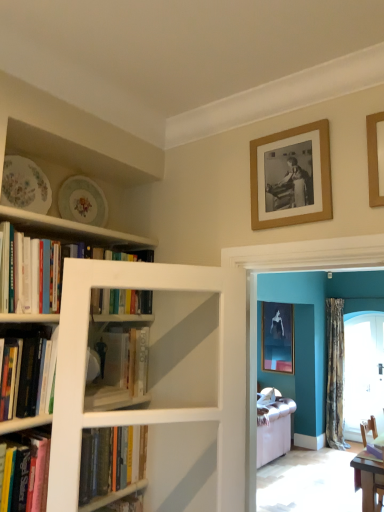
This screenshot has height=512, width=384. Identify the location of hardcover book at center, marked as the fifth book in a top-to-bottom arrangement. (117, 478).

Measure the distance between hardcover books at left, which is the 5th book from bottom to top, and camera.

They are 4.46 feet apart.

The height and width of the screenshot is (512, 384). Describe the element at coordinates (277, 337) in the screenshot. I see `matte black picture frame at upper center, the third picture frame positioned from the front` at that location.

This screenshot has width=384, height=512. What do you see at coordinates (36, 467) in the screenshot?
I see `hardcover book at left, the 2th book when ordered from bottom to top` at bounding box center [36, 467].

Image resolution: width=384 pixels, height=512 pixels. I want to click on clear glass door at right, so 363,371.

Is camouflage fabric curtain at right taller or shorter than matte black picture frame at upper center, positioned as the 3th picture frame in left-to-right order?

In the image, camouflage fabric curtain at right appears to be taller than matte black picture frame at upper center, positioned as the 3th picture frame in left-to-right order.

From the image's perspective, which object appears higher, camouflage fabric curtain at right or matte black picture frame at upper center, which is counted as the 1th picture frame, starting from the right?

matte black picture frame at upper center, which is counted as the 1th picture frame, starting from the right, appears higher in the image.

Is matte black picture frame at upper center, positioned as the third picture frame in top-to-bottom order, at the back of camouflage fabric curtain at right?

camouflage fabric curtain at right is not turned away from matte black picture frame at upper center, positioned as the third picture frame in top-to-bottom order.

Are camouflage fabric curtain at right and matte black picture frame at upper center, which appears as the first picture frame when ordered from the bottom, making contact?

camouflage fabric curtain at right and matte black picture frame at upper center, which appears as the first picture frame when ordered from the bottom, are not in contact.

Considering the positions of points (340, 318) and (47, 365), is point (340, 318) closer to camera compared to point (47, 365)?

No, it is not.

Is hardcover book at left, which is the second book from top to bottom, a part of camouflage fabric curtain at right?

That's incorrect, hardcover book at left, which is the second book from top to bottom, is not inside camouflage fabric curtain at right.

Which of these two, camouflage fabric curtain at right or hardcover book at left, which is the second book from top to bottom, is wider?

With larger width is camouflage fabric curtain at right.

Is camouflage fabric curtain at right positioned before hardcover book at left, which is the second book from top to bottom?

That is False.

How many degrees apart are the facing directions of wooden picture frame at upper right, the second picture frame viewed from the right, and wooden chair at lower right?

The angular difference between wooden picture frame at upper right, the second picture frame viewed from the right, and wooden chair at lower right is 91.3 degrees.

Is wooden picture frame at upper right, arranged as the 1th picture frame when viewed from the front, positioned behind wooden chair at lower right?

That is False.

Between wooden picture frame at upper right, the 1th picture frame viewed from the top, and wooden chair at lower right, which one has more height?

Standing taller between the two is wooden chair at lower right.

Is wooden chair at lower right surrounded by wooden picture frame at upper right, the 3th picture frame when ordered from back to front?

No, wooden picture frame at upper right, the 3th picture frame when ordered from back to front, does not contain wooden chair at lower right.

Can we say porcelain floral plate at upper left, which appears as the first plate when viewed from the right, lies outside hardcover book at left, which is the second book from top to bottom?

Yes, porcelain floral plate at upper left, which appears as the first plate when viewed from the right, is located beyond the bounds of hardcover book at left, which is the second book from top to bottom.

Is porcelain floral plate at upper left, which is the first plate in back-to-front order, positioned far away from hardcover book at left, which appears as the fourth book when ordered from the bottom?

They are positioned close to each other.

How different are the orientations of porcelain floral plate at upper left, which appears as the first plate when viewed from the right, and hardcover book at left, which is the second book from top to bottom, in degrees?

The angle between the facing direction of porcelain floral plate at upper left, which appears as the first plate when viewed from the right, and the facing direction of hardcover book at left, which is the second book from top to bottom, is 0.603 degrees.

Find the location of a particular element. the 2nd book positioned below the porcelain floral plate at upper left, which is the first plate in back-to-front order (from the image's perspective) is located at coordinates (33, 374).

Is wooden framed photo at upper right, which is the 1th picture frame in left-to-right order, beside hardcover book at left, which is the 4th book from top to bottom?

No, wooden framed photo at upper right, which is the 1th picture frame in left-to-right order, is not with hardcover book at left, which is the 4th book from top to bottom.

Considering the sizes of objects wooden framed photo at upper right, the second picture frame positioned from the bottom, and hardcover book at left, the 2th book when ordered from bottom to top, in the image provided, who is wider, wooden framed photo at upper right, the second picture frame positioned from the bottom, or hardcover book at left, the 2th book when ordered from bottom to top,?

hardcover book at left, the 2th book when ordered from bottom to top.

Which is behind, point (263, 144) or point (38, 511)?

The point (263, 144) is more distant.

From a real-world perspective, is wooden framed photo at upper right, which ranks as the 2th picture frame in back-to-front order, physically located above or below hardcover book at left, the 2th book when ordered from bottom to top?

Clearly, from a real-world perspective, wooden framed photo at upper right, which ranks as the 2th picture frame in back-to-front order, is above hardcover book at left, the 2th book when ordered from bottom to top.

Which object is more forward, camouflage fabric curtain at right or porcelain floral plate at upper left, acting as the first plate starting from the left?

porcelain floral plate at upper left, acting as the first plate starting from the left, is more forward.

Is camouflage fabric curtain at right taller or shorter than porcelain floral plate at upper left, which is the 2th plate from right to left?

In the image, camouflage fabric curtain at right appears to be taller than porcelain floral plate at upper left, which is the 2th plate from right to left.

Is camouflage fabric curtain at right next to porcelain floral plate at upper left, marked as the first plate in a front-to-back arrangement?

camouflage fabric curtain at right and porcelain floral plate at upper left, marked as the first plate in a front-to-back arrangement, are not in contact.

Between camouflage fabric curtain at right and porcelain floral plate at upper left, acting as the first plate starting from the left, which one has larger width?

With larger width is camouflage fabric curtain at right.

Consider the image. Is porcelain floral plate at upper left, marked as the second plate in a front-to-back arrangement, to the left or to the right of wooden chair at lower right in the image?

porcelain floral plate at upper left, marked as the second plate in a front-to-back arrangement, is to the left of wooden chair at lower right.

Would you consider porcelain floral plate at upper left, which is the first plate in back-to-front order, to be distant from wooden chair at lower right?

Yes.

Between point (96, 184) and point (380, 484), which one is positioned behind?

The point (380, 484) is farther from the camera.

Between porcelain floral plate at upper left, marked as the second plate in a front-to-back arrangement, and wooden chair at lower right, which one has more height?

wooden chair at lower right.

Which picture frame is the 1st one when counting from the left side of the camouflage fabric curtain at right? Please provide its 2D coordinates.

[(277, 337)]

Image resolution: width=384 pixels, height=512 pixels. There is a camouflage fabric curtain at right. In order to click on the 4th book above it (from the image's perspective) in this screenshot , I will do `click(33, 374)`.

When comparing their distances from wooden picture frame at upper right, the 3th picture frame when ordered from back to front, does hardcover book at left, which is the second book from top to bottom, or porcelain floral plate at upper left, which appears as the first plate when viewed from the right, seem further?

Among the two, hardcover book at left, which is the second book from top to bottom, is located further to wooden picture frame at upper right, the 3th picture frame when ordered from back to front.

Which object lies further to the anchor point wooden framed photo at upper right, which ranks as the 2th picture frame in back-to-front order, porcelain floral plate at upper left, marked as the second plate in a front-to-back arrangement, or wooden chair at lower right?

wooden chair at lower right is further to wooden framed photo at upper right, which ranks as the 2th picture frame in back-to-front order.

Based on their spatial positions, is porcelain floral plate at upper left, which is the 2th plate from right to left, or hardcover book at left, the 2th book when ordered from bottom to top, further from hardcover book at center, marked as the fifth book in a top-to-bottom arrangement?

porcelain floral plate at upper left, which is the 2th plate from right to left, is further to hardcover book at center, marked as the fifth book in a top-to-bottom arrangement.

Estimate the real-world distances between objects in this image. Which object is closer to wooden picture frame at upper right, arranged as the 1th picture frame when viewed from the front, porcelain floral plate at upper left, which is the second plate from left to right, or hardcover book at center, marked as the fifth book in a top-to-bottom arrangement?

porcelain floral plate at upper left, which is the second plate from left to right, is closer to wooden picture frame at upper right, arranged as the 1th picture frame when viewed from the front.

Which object lies further to the anchor point wooden picture frame at upper right, the second picture frame viewed from the right, camouflage fabric curtain at right or hardcover book at center, marked as the fifth book in a top-to-bottom arrangement?

camouflage fabric curtain at right is positioned further to the anchor wooden picture frame at upper right, the second picture frame viewed from the right.

Based on the photo, estimate the real-world distances between objects in this image. Which object is closer to hardcover book at left, which is the second book from top to bottom, hardcover book at center, the first book positioned from the bottom, or clear glass door at right?

Among the two, hardcover book at center, the first book positioned from the bottom, is located nearer to hardcover book at left, which is the second book from top to bottom.

When comparing their distances from hardcover book at left, which appears as the fourth book when ordered from the bottom, does clear glass door at right or hardcover books at left, placed as the 1th book when sorted from top to bottom, seem further?

Based on the image, clear glass door at right appears to be further to hardcover book at left, which appears as the fourth book when ordered from the bottom.

Based on their spatial positions, is matte black picture frame at upper center, positioned as the 3th picture frame in left-to-right order, or hardcover book at left, which appears as the fourth book when ordered from the bottom, closer to wooden chair at lower right?

Among the two, matte black picture frame at upper center, positioned as the 3th picture frame in left-to-right order, is located nearer to wooden chair at lower right.

Identify the location of plate located between porcelain floral plate at upper left, which is the 2th plate from right to left, and wooden chair at lower right in the left-right direction. (83, 201).

The height and width of the screenshot is (512, 384). I want to click on curtain located between hardcover book at center, the 3th book viewed from the top, and clear glass door at right in the depth direction, so click(x=335, y=373).

You are a GUI agent. You are given a task and a screenshot of the screen. Output one action in this format:
    pyautogui.click(x=<x>, y=<y>)
    Task: Click on the glass door between hardcover books at left, placed as the 1th book when sorted from top to bottom, and matte black picture frame at upper center, the 1th picture frame when ordered from back to front, in the front-back direction
    The width and height of the screenshot is (384, 512).
    Given the screenshot: What is the action you would take?
    (x=363, y=371)

The height and width of the screenshot is (512, 384). Identify the location of plate between hardcover book at left, which is the 4th book from top to bottom, and wooden chair at lower right from left to right. (83, 201).